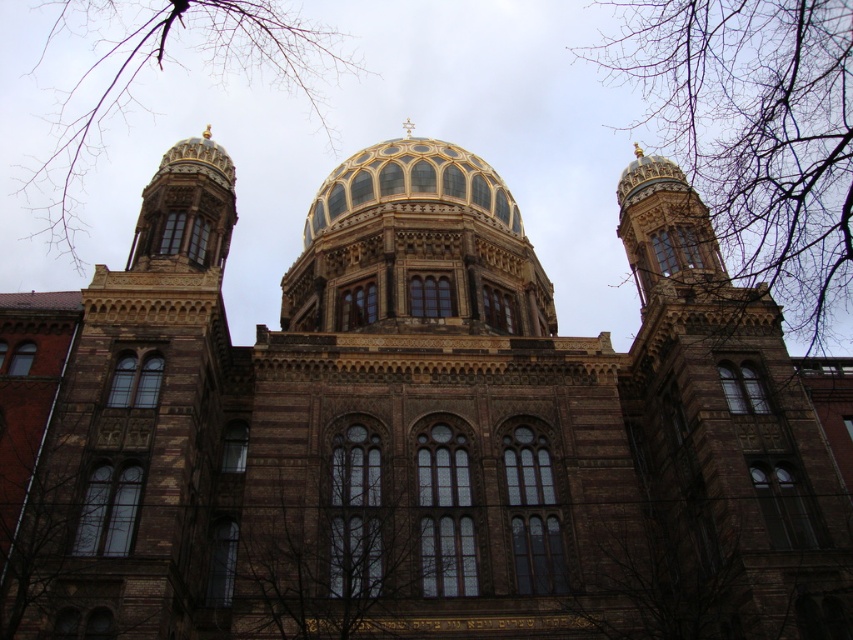
Question: Which of these objects is positioned closest to the bare branches at upper left?

Choices:
 (A) bare branches at upper center
 (B) gold/glass dome at center
 (C) transparent glass windows at center

Answer: (B)

Question: Does transparent glass windows at center appear over gold/glass dome at center?

Choices:
 (A) no
 (B) yes

Answer: (A)

Question: From the image, what is the correct spatial relationship of bare branches at upper center in relation to bare branches at upper left?

Choices:
 (A) right
 (B) left

Answer: (A)

Question: Estimate the real-world distances between objects in this image. Which object is farther from the transparent glass windows at center?

Choices:
 (A) gold/glass dome at center
 (B) bare branches at upper center
 (C) bare branches at upper left

Answer: (C)

Question: Which object appears closest to the camera in this image?

Choices:
 (A) gold/glass dome at center
 (B) transparent glass windows at center
 (C) bare branches at upper center
 (D) bare branches at upper left

Answer: (B)

Question: Where is bare branches at upper center located in relation to transparent glass windows at center in the image?

Choices:
 (A) above
 (B) below

Answer: (A)